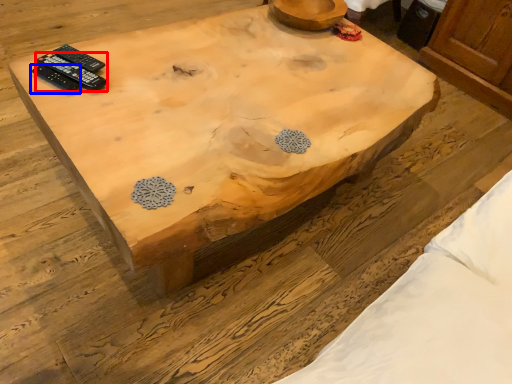
Question: Among these objects, which one is nearest to the camera, remote control (highlighted by a red box) or remote control (highlighted by a blue box)?

Choices:
 (A) remote control
 (B) remote control

Answer: (B)